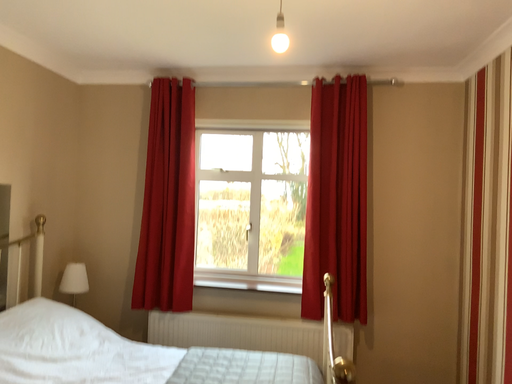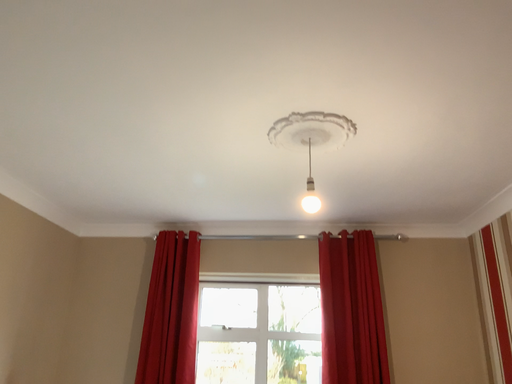
Question: Which way did the camera rotate in the video?

Choices:
 (A) rotated upward
 (B) rotated downward

Answer: (A)